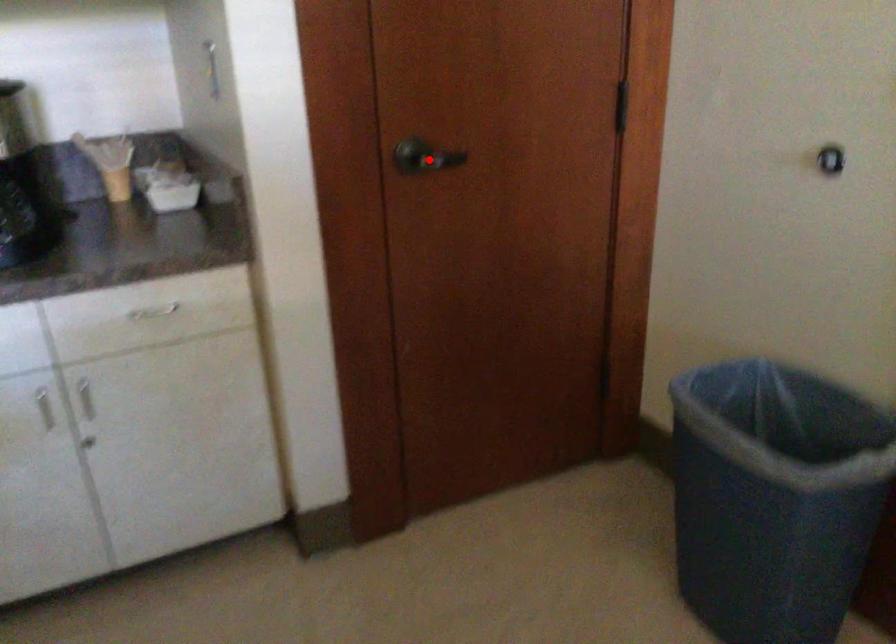
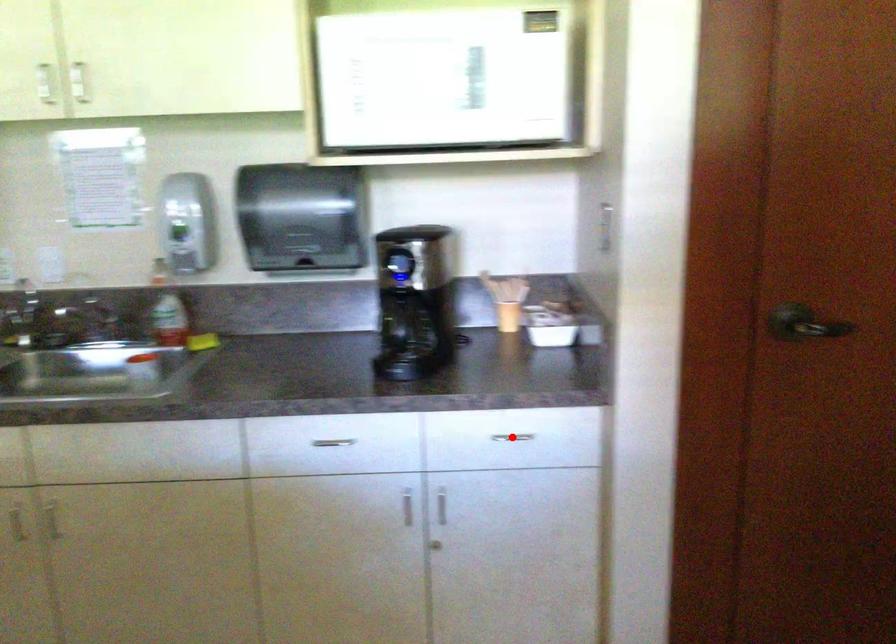
I am providing you with two images of the same scene from different viewpoints. A red point is marked on the first image and another point is marked on the second image. Do the highlighted points in image1 and image2 indicate the same real-world spot?

No